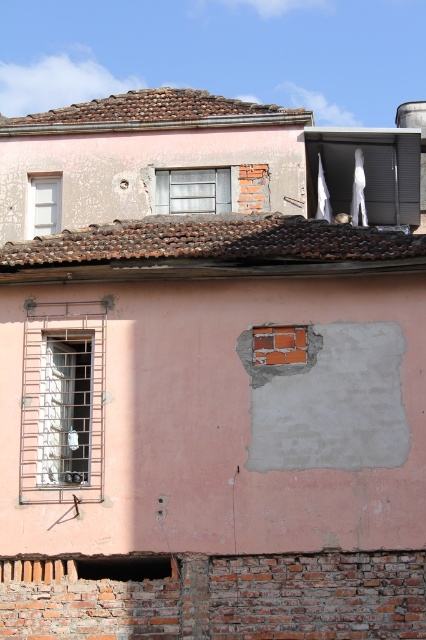
Is point (380, 138) farther from viewer compared to point (51, 196)?

No, it is not.

In order to click on white fabric at upper center in this screenshot , I will do `click(365, 173)`.

Can you confirm if metallic wire mesh window at left is taller than white matte window at upper left?

Yes.

Which is above, metallic wire mesh window at left or white matte window at upper left?

Positioned higher is white matte window at upper left.

The width and height of the screenshot is (426, 640). Identify the location of metallic wire mesh window at left. (63, 401).

This screenshot has width=426, height=640. Find the location of `metallic wire mesh window at left`. metallic wire mesh window at left is located at coordinates (63, 401).

Describe the element at coordinates (192, 189) in the screenshot. I see `metallic gray window at center` at that location.

Measure the distance between point (155, 170) and camera.

Point (155, 170) is 28.42 meters away from camera.

Locate an element on the screen. This screenshot has width=426, height=640. metallic gray window at center is located at coordinates (192, 189).